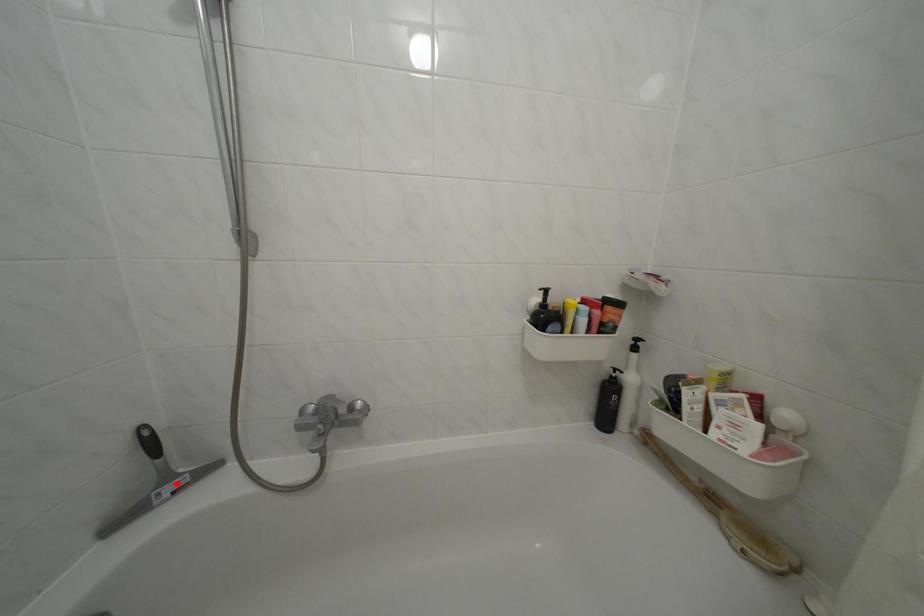
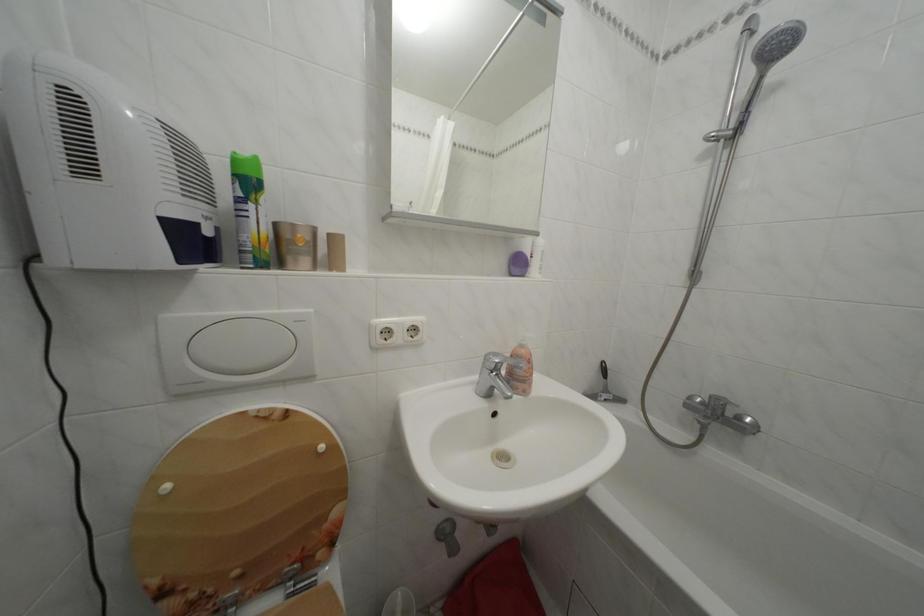
The point at the highlighted location is marked in the first image. Where is the corresponding point in the second image?

(614, 397)